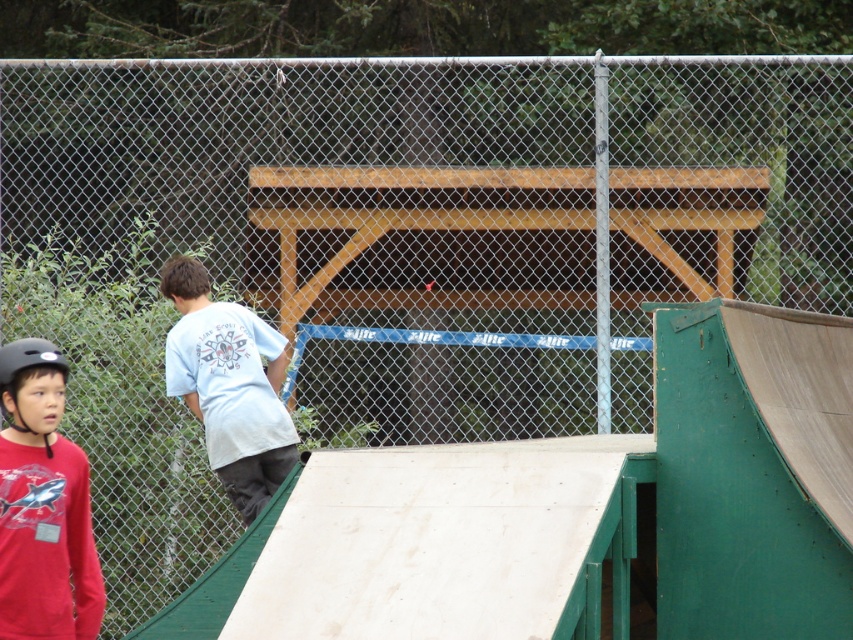
Looking at this image, you are a photographer trying to capture a photo of the white cotton shirt at center and the matte black helmet at left. Based on their positions, which object would appear closer to the bottom of the photo frame?

The white cotton shirt at center appears closer to the bottom of the photo frame because it is positioned below the matte black helmet at left.

You are a photographer trying to capture a clear shot of the red matte shirt at left and the matte black helmet at left. Based on their sizes, which object should you focus on first to ensure both are in focus?

The red matte shirt at left is larger in size than the matte black helmet at left, so focusing on the larger red matte shirt at left first will help ensure both are in focus since it occupies more of the frame.

You are a photographer standing at the center of the skate park. You want to take a photo of the red matte shirt at left. Based on the coordinates provided, in which direction should you move to frame the subject properly?

The red matte shirt at left is located at coordinates point (x=44, y=506). Since the photographer is at the center, moving towards the left side of the skate park would align the camera with the subject.